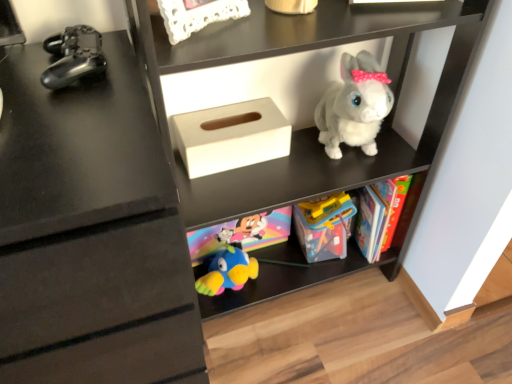
Question: In terms of height, does white matte plush rabbit at upper center look taller or shorter compared to white matte tissue box at center?

Choices:
 (A) tall
 (B) short

Answer: (A)

Question: From the image's perspective, relative to white matte tissue box at center, is white matte plush rabbit at upper center above or below?

Choices:
 (A) below
 (B) above

Answer: (A)

Question: Considering the real-world distances, which object is closest to the metallic black controller at left, which appears as the 1th toy when viewed from the front?

Choices:
 (A) fluffy white plush rabbit at upper right, which appears as the 2th toy when viewed from the front
 (B) translucent plastic toy at center, acting as the first toy starting from the back
 (C) white matte plush rabbit at upper center
 (D) white matte tissue box at center

Answer: (D)

Question: Based on their relative distances, which object is farther from the metallic black controller at left, which appears as the 1th toy when viewed from the front?

Choices:
 (A) white matte plush rabbit at upper center
 (B) translucent plastic toy at center, acting as the first toy starting from the back
 (C) white matte tissue box at center
 (D) fluffy white plush rabbit at upper right, the 1th toy in the right-to-left sequence

Answer: (B)